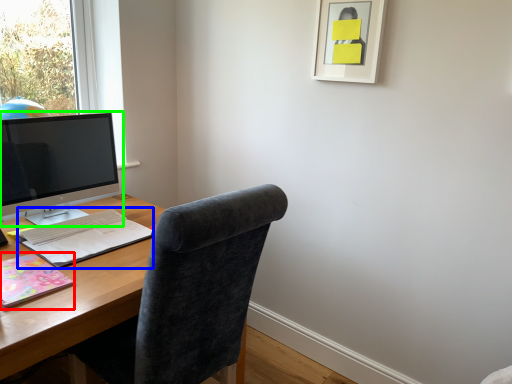
Question: Which object is positioned closest to notebook (highlighted by a red box)? Select from notebook (highlighted by a blue box) and computer monitor (highlighted by a green box).

Choices:
 (A) notebook
 (B) computer monitor

Answer: (A)